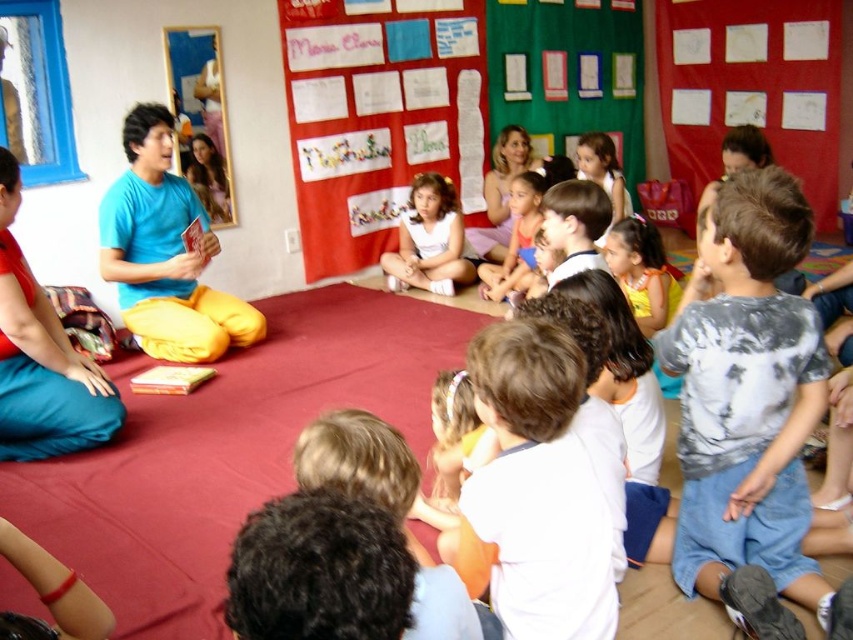
Which is more to the left, gray tie-dye shirt at lower right or matte pink dress at center?

matte pink dress at center

Can you confirm if gray tie-dye shirt at lower right is positioned to the right of matte pink dress at center?

Yes, gray tie-dye shirt at lower right is to the right of matte pink dress at center.

The image size is (853, 640). What are the coordinates of `gray tie-dye shirt at lower right` in the screenshot? It's located at (747, 400).

This screenshot has width=853, height=640. Identify the location of gray tie-dye shirt at lower right. (747, 400).

Is point (613, 544) positioned in front of point (485, 288)?

Yes.

In the scene shown: Is white cotton shirt at lower center taller than matte pink dress at center?

No, white cotton shirt at lower center is not taller than matte pink dress at center.

Who is more distant from viewer, (578, 516) or (521, 237)?

The point (521, 237) is behind.

The height and width of the screenshot is (640, 853). What are the coordinates of `white cotton shirt at lower center` in the screenshot? It's located at (537, 492).

From the picture: Between white cotton shirt at lower center and matte blue shirt at center, which one appears on the left side from the viewer's perspective?

matte blue shirt at center is more to the left.

Consider the image. Is white cotton shirt at lower center to the left of matte blue shirt at center from the viewer's perspective?

In fact, white cotton shirt at lower center is to the right of matte blue shirt at center.

Is point (473, 522) positioned behind point (6, 428)?

No.

I want to click on white cotton shirt at lower center, so click(x=537, y=492).